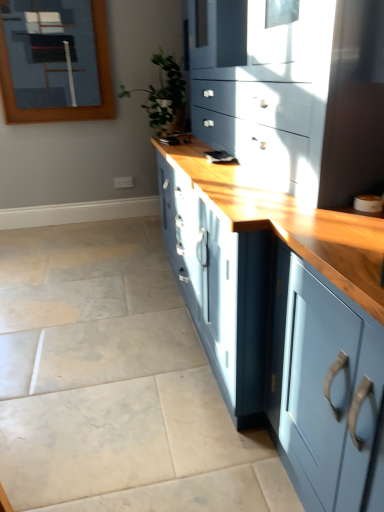
Question: Considering their positions, is matte blue cabinet at center located in front of or behind wooden frame at upper left?

Choices:
 (A) behind
 (B) front

Answer: (B)

Question: Visually, is matte blue cabinet at center positioned to the left or to the right of wooden frame at upper left?

Choices:
 (A) left
 (B) right

Answer: (B)

Question: Estimate the real-world distances between objects in this image. Which object is farther from the wooden frame at upper left?

Choices:
 (A) matte blue cabinet at center
 (B) green leafy plant at center

Answer: (A)

Question: Estimate the real-world distances between objects in this image. Which object is closer to the green leafy plant at center?

Choices:
 (A) wooden frame at upper left
 (B) matte blue cabinet at center

Answer: (A)